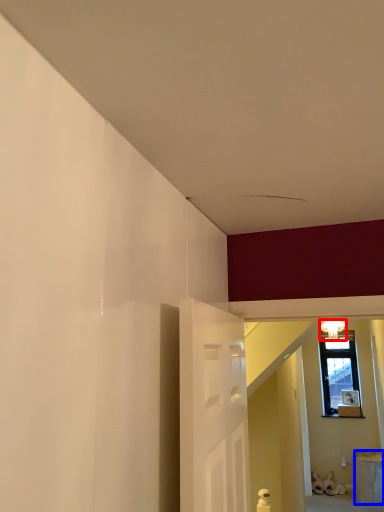
Question: Which object is further to the camera taking this photo, light fixture (highlighted by a red box) or furniture (highlighted by a blue box)?

Choices:
 (A) light fixture
 (B) furniture

Answer: (B)